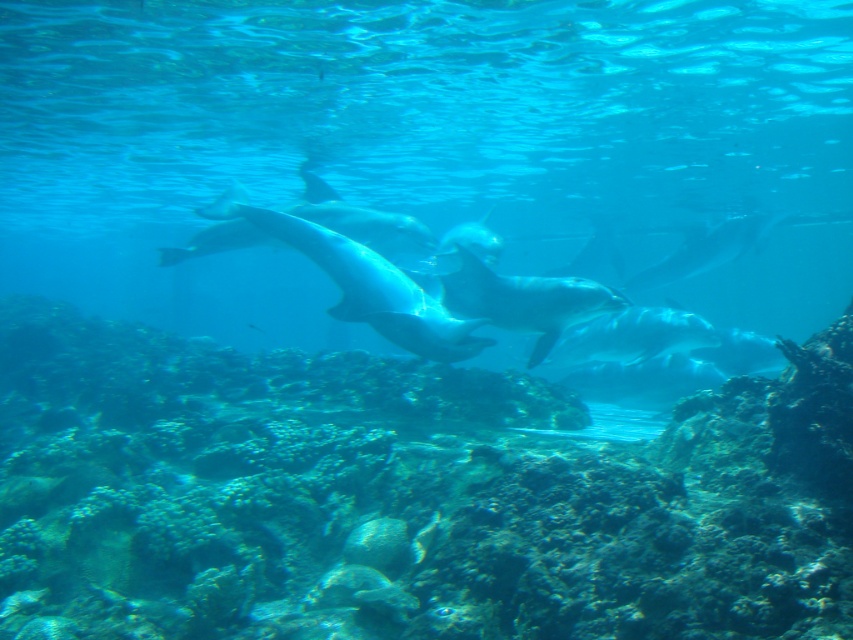
Between point (328, 275) and point (628, 346), which one is positioned behind?

Point (628, 346)

Consider the image. Which is more to the left, white smooth dolphin at center or smooth silver dolphin at center?

white smooth dolphin at center

Describe the element at coordinates (369, 285) in the screenshot. I see `white smooth dolphin at center` at that location.

Locate an element on the screen. Image resolution: width=853 pixels, height=640 pixels. white smooth dolphin at center is located at coordinates click(369, 285).

What do you see at coordinates (524, 300) in the screenshot?
I see `glossy blue dolphin at center` at bounding box center [524, 300].

Find the location of a particular element. glossy blue dolphin at center is located at coordinates (524, 300).

Can you confirm if glossy blue dolphin at center is positioned to the left of glossy white dolphin at center?

Correct, you'll find glossy blue dolphin at center to the left of glossy white dolphin at center.

Can you confirm if glossy blue dolphin at center is positioned to the right of glossy white dolphin at center?

No, glossy blue dolphin at center is not to the right of glossy white dolphin at center.

Is point (496, 282) closer to viewer compared to point (686, 275)?

Yes, it is in front of point (686, 275).

The height and width of the screenshot is (640, 853). Find the location of `glossy blue dolphin at center`. glossy blue dolphin at center is located at coordinates (524, 300).